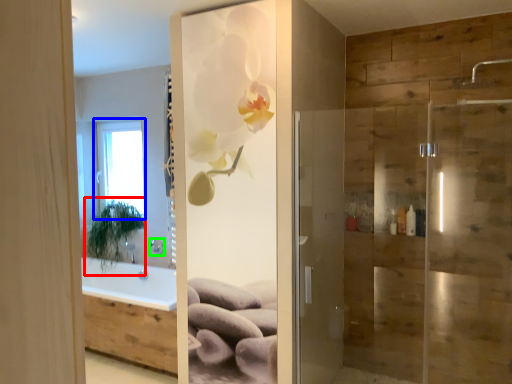
Question: Which is farther away from plant (highlighted by a red box)? window (highlighted by a blue box) or shower (highlighted by a green box)?

Choices:
 (A) window
 (B) shower

Answer: (B)